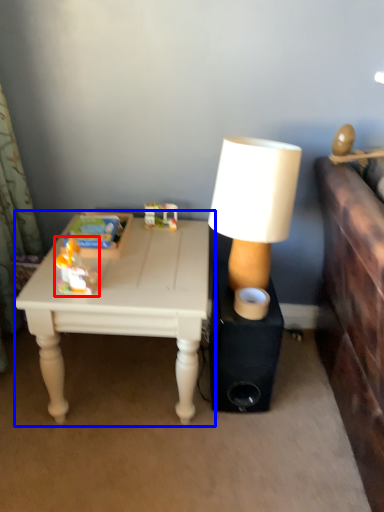
Question: Which object appears closest to the camera in this image, toy (highlighted by a red box) or table (highlighted by a blue box)?

Choices:
 (A) toy
 (B) table

Answer: (A)